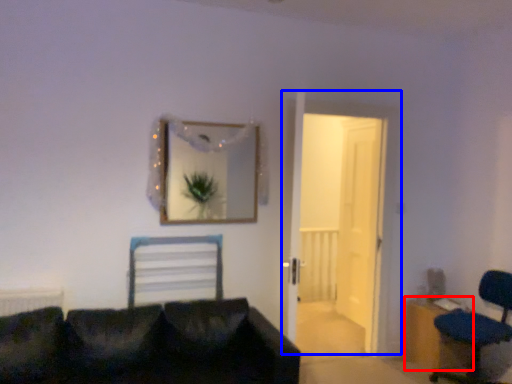
Question: Which of the following is the farthest to the observer, dresser (highlighted by a red box) or door (highlighted by a blue box)?

Choices:
 (A) dresser
 (B) door

Answer: (A)